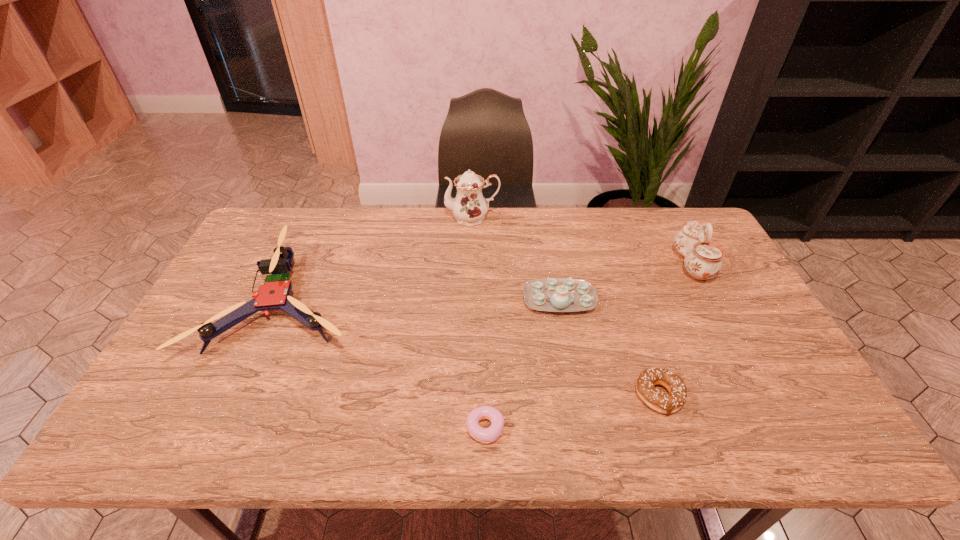
Where is `free space between the tallest chinaware and the third shortest object`? The width and height of the screenshot is (960, 540). free space between the tallest chinaware and the third shortest object is located at coordinates (516, 259).

Where is `free spot between the tallest object and the shorter doughnut`? This screenshot has height=540, width=960. free spot between the tallest object and the shorter doughnut is located at coordinates (479, 323).

At what (x,y) coordinates should I click in order to perform the action: click on free space between the rightmost object and the drone. Please return your answer as a coordinate pair (x, y). The height and width of the screenshot is (540, 960). Looking at the image, I should click on (490, 283).

In order to click on vacant point located between the right doughnut and the second chinaware from left to right in this screenshot , I will do `click(609, 348)`.

At what (x,y) coordinates should I click in order to perform the action: click on vacant space that's between the farthest object and the shortest object. Please return your answer as a coordinate pair (x, y). The width and height of the screenshot is (960, 540). Looking at the image, I should click on (479, 323).

The width and height of the screenshot is (960, 540). What are the coordinates of `vacant space that is in between the rightmost chinaware and the drone` in the screenshot? It's located at (490, 283).

Find the location of a particular element. The height and width of the screenshot is (540, 960). free area in between the taller doughnut and the rightmost object is located at coordinates (676, 330).

Locate an element on the screen. The height and width of the screenshot is (540, 960). empty space between the rightmost chinaware and the third object from right to left is located at coordinates (625, 282).

Select which object is the closest to the fifth shortest object. Please provide its 2D coordinates. Your answer should be formatted as a tuple, i.e. [(x, y)], where the tuple contains the x and y coordinates of a point satisfying the conditions above.

[(549, 294)]

Where is `object that is the fifth closest to the left doughnut`? The image size is (960, 540). object that is the fifth closest to the left doughnut is located at coordinates (469, 207).